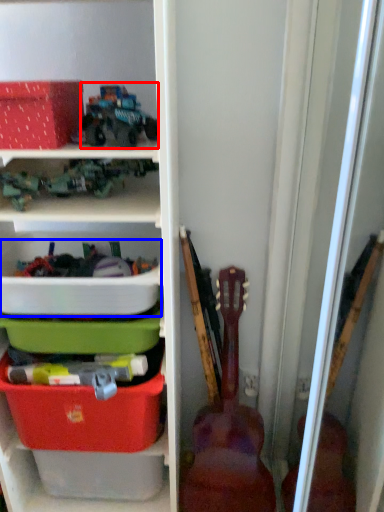
Question: Which of the following is the farthest to the observer, toy (highlighted by a red box) or storage box (highlighted by a blue box)?

Choices:
 (A) toy
 (B) storage box

Answer: (B)